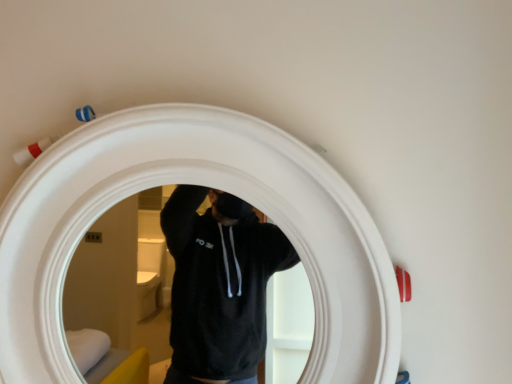
What do you see at coordinates (203, 185) in the screenshot? I see `white matte archway at center` at bounding box center [203, 185].

Where is `white matte archway at center`? white matte archway at center is located at coordinates 203,185.

This screenshot has height=384, width=512. Find the location of `white matte archway at center`. white matte archway at center is located at coordinates [x=203, y=185].